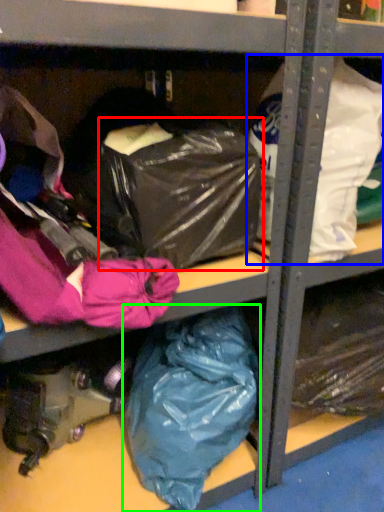
Question: Which object is positioned closest to bag (highlighted by a red box)? Select from plastic bag (highlighted by a blue box) and plastic bag (highlighted by a green box).

Choices:
 (A) plastic bag
 (B) plastic bag

Answer: (A)